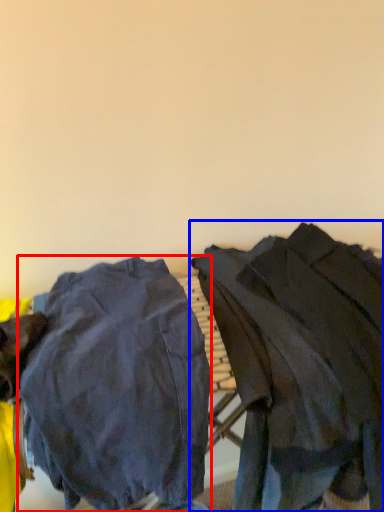
Question: Which point is further to the camera, tight (highlighted by a red box) or jacket (highlighted by a blue box)?

Choices:
 (A) tight
 (B) jacket

Answer: (B)